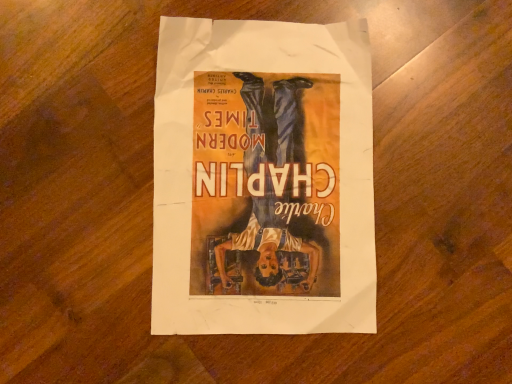
Where is `free location above vintage paper poster at center (from a real-world perspective)`? This screenshot has width=512, height=384. free location above vintage paper poster at center (from a real-world perspective) is located at coordinates (263, 175).